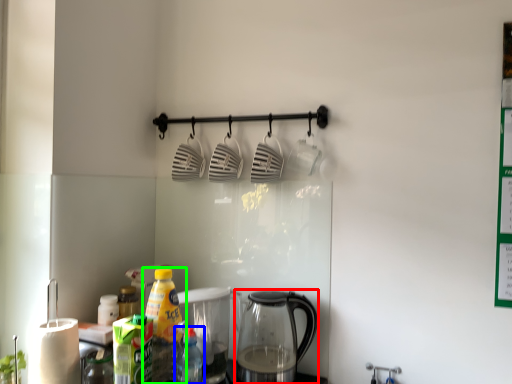
Question: Which object is positioned farthest from kettle (highlighted by a red box)? Select from bottle (highlighted by a blue box) and bottle (highlighted by a green box).

Choices:
 (A) bottle
 (B) bottle

Answer: (B)